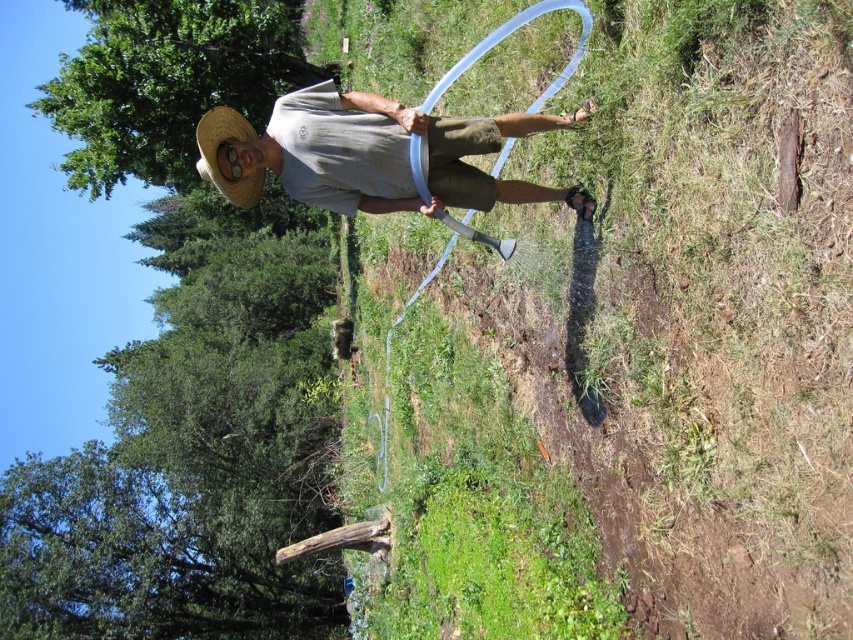
Can you confirm if matte straw hat at center is smaller than straw hat at center?

Actually, matte straw hat at center might be larger than straw hat at center.

Which is behind, point (361, 186) or point (213, 141)?

The point (361, 186) is more distant.

Image resolution: width=853 pixels, height=640 pixels. I want to click on matte straw hat at center, so click(364, 154).

Is translucent plastic hose at center closer to the viewer compared to straw hat at center?

Yes, it is in front of straw hat at center.

Can you confirm if translucent plastic hose at center is positioned to the left of straw hat at center?

In fact, translucent plastic hose at center is to the right of straw hat at center.

Is point (810, 134) closer to camera compared to point (253, 176)?

Yes, point (810, 134) is closer to viewer.

Find the location of a particular element. Image resolution: width=853 pixels, height=640 pixels. translucent plastic hose at center is located at coordinates (630, 358).

Does point (740, 502) lie in front of point (450, 145)?

Yes, point (740, 502) is in front of point (450, 145).

Consider the image. Can you confirm if translucent plastic hose at center is positioned above matte straw hat at center?

No, translucent plastic hose at center is not above matte straw hat at center.

Between point (757, 634) and point (476, 147), which one is positioned behind?

Point (476, 147)

Locate an element on the screen. The height and width of the screenshot is (640, 853). translucent plastic hose at center is located at coordinates (630, 358).